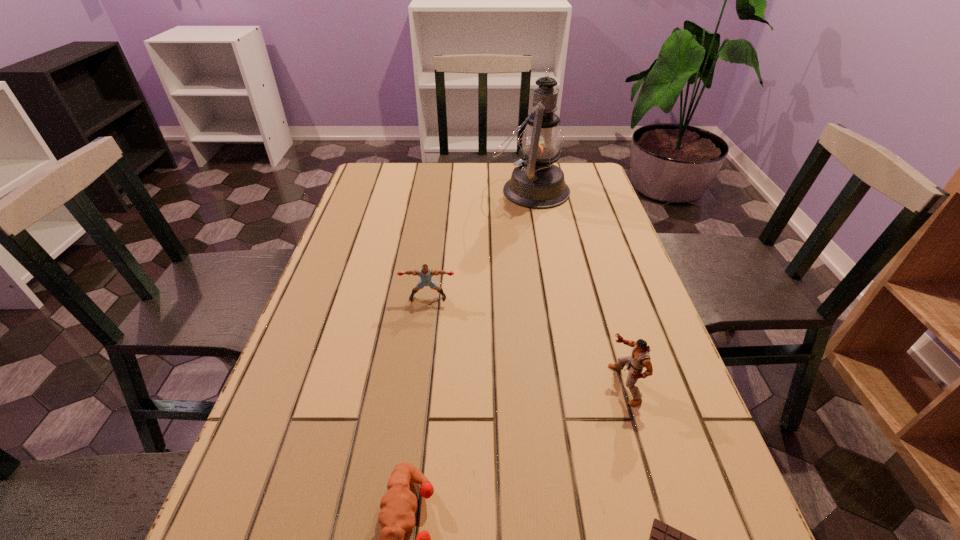
Find the location of a particular element. oil lamp is located at coordinates (537, 183).

You are a GUI agent. You are given a task and a screenshot of the screen. Output one action in this format:
    pyautogui.click(x=<x>, y=<y>)
    Task: Click on the farthest object
    
    Given the screenshot: What is the action you would take?
    pyautogui.click(x=537, y=183)

Image resolution: width=960 pixels, height=540 pixels. Identify the location of the second nearest puncher. (640, 358).

Where is `the fourth shortest object`? the fourth shortest object is located at coordinates (640, 358).

Identify the location of the second shortest puncher. The height and width of the screenshot is (540, 960). [x=425, y=273].

Where is `the fourth nearest object`? Image resolution: width=960 pixels, height=540 pixels. the fourth nearest object is located at coordinates (425, 273).

The width and height of the screenshot is (960, 540). I want to click on free location located 0.310m on the front of the oil lamp, so 545,275.

In order to click on free location located on the front-facing side of the third farthest object in this screenshot , I will do `click(534, 384)`.

At what (x,y) coordinates should I click in order to perform the action: click on blank area located 0.120m on the front-facing side of the third farthest object. Please return your answer as a coordinate pair (x, y). The image size is (960, 540). Looking at the image, I should click on (549, 384).

The image size is (960, 540). What are the coordinates of `vacant area situated on the front-facing side of the third farthest object` in the screenshot? It's located at (514, 384).